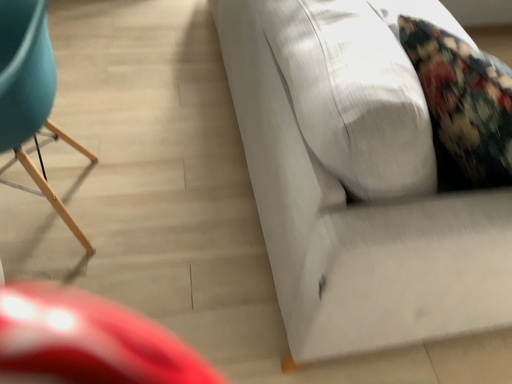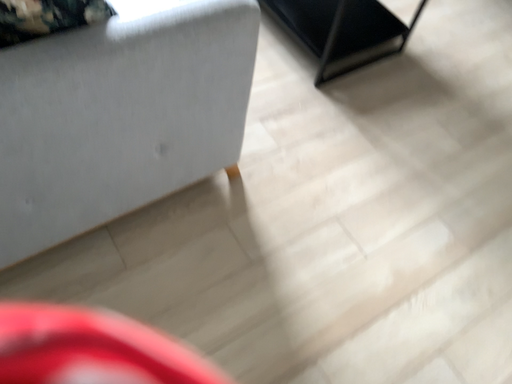
Question: Which way did the camera rotate in the video?

Choices:
 (A) rotated left
 (B) rotated right

Answer: (B)